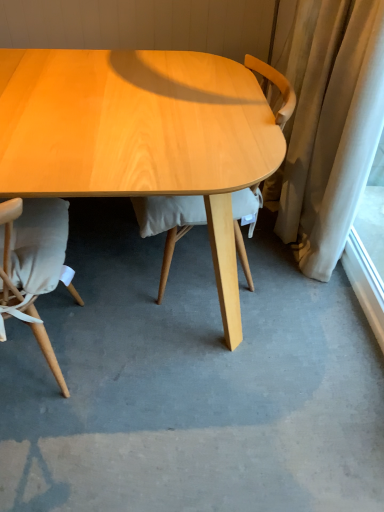
Question: Can you confirm if matte beige chair at lower left, the 2th chair when ordered from right to left, is shorter than white sheer curtain at right?

Choices:
 (A) no
 (B) yes

Answer: (A)

Question: From the image's perspective, is matte beige chair at lower left, the 2th chair when ordered from right to left, located above white sheer curtain at right?

Choices:
 (A) no
 (B) yes

Answer: (A)

Question: Does matte beige chair at lower left, the 2th chair when ordered from right to left, have a smaller size compared to white sheer curtain at right?

Choices:
 (A) yes
 (B) no

Answer: (B)

Question: Is matte beige chair at lower left, the 1th chair in the left-to-right sequence, thinner than white sheer curtain at right?

Choices:
 (A) yes
 (B) no

Answer: (B)

Question: Can you confirm if matte beige chair at lower left, the 1th chair in the left-to-right sequence, is positioned to the right of white sheer curtain at right?

Choices:
 (A) no
 (B) yes

Answer: (A)

Question: In the image, is matte beige chair at lower left, the 1th chair in the left-to-right sequence, positioned in front of or behind light wood chair at center, the 1th chair positioned from the right?

Choices:
 (A) front
 (B) behind

Answer: (A)

Question: Would you say matte beige chair at lower left, the 2th chair when ordered from right to left, is to the left or to the right of light wood chair at center, which is counted as the second chair, starting from the left, in the picture?

Choices:
 (A) right
 (B) left

Answer: (B)

Question: Looking at their shapes, would you say matte beige chair at lower left, the 2th chair when ordered from right to left, is wider or thinner than light wood chair at center, the 1th chair positioned from the right?

Choices:
 (A) thin
 (B) wide

Answer: (B)

Question: Is matte beige chair at lower left, the 2th chair when ordered from right to left, taller or shorter than light wood chair at center, which is counted as the second chair, starting from the left?

Choices:
 (A) tall
 (B) short

Answer: (B)

Question: Considering their positions, is white sheer curtain at right located in front of or behind matte beige chair at lower left, the 2th chair when ordered from right to left?

Choices:
 (A) front
 (B) behind

Answer: (B)

Question: Is point (375, 309) positioned closer to the camera than point (49, 253)?

Choices:
 (A) closer
 (B) farther

Answer: (B)

Question: Choose the correct answer: Is white sheer curtain at right inside matte beige chair at lower left, the 2th chair when ordered from right to left, or outside it?

Choices:
 (A) inside
 (B) outside

Answer: (B)

Question: Looking at the image, does white sheer curtain at right seem bigger or smaller compared to matte beige chair at lower left, the 2th chair when ordered from right to left?

Choices:
 (A) big
 (B) small

Answer: (B)

Question: In the image, is matte beige chair at lower left, the 2th chair when ordered from right to left, positioned in front of or behind white sheer curtain at right?

Choices:
 (A) front
 (B) behind

Answer: (A)

Question: From the image's perspective, is matte beige chair at lower left, the 1th chair in the left-to-right sequence, located above or below white sheer curtain at right?

Choices:
 (A) above
 (B) below

Answer: (B)